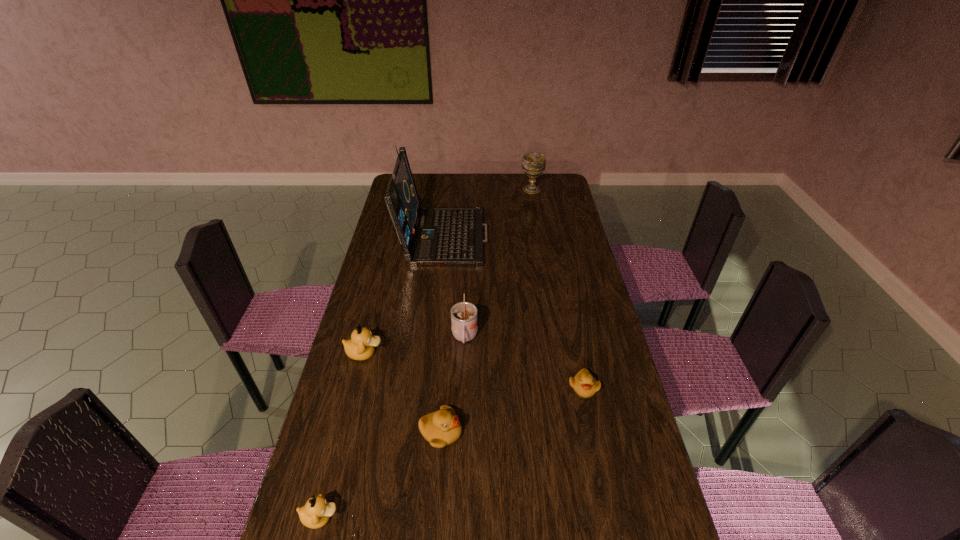
Find the location of a particular element. Image resolution: width=960 pixels, height=540 pixels. the nearer tan duckling is located at coordinates (316, 513).

I want to click on the third nearest object, so click(x=584, y=384).

Identify the location of the farther yellow duckling. The image size is (960, 540). (584, 384).

Find the location of a particular element. vacant space located on the front-facing side of the tallest object is located at coordinates (543, 234).

I want to click on free space located on the front of the second tallest object, so click(537, 220).

Locate an element on the screen. The height and width of the screenshot is (540, 960). vacant point located on the side with the handle of the cup is located at coordinates (463, 385).

This screenshot has width=960, height=540. In order to click on free space located 0.360m on the face of the tallest duckling in this screenshot , I will do `click(497, 353)`.

Find the location of a particular element. The image size is (960, 540). vacant space located 0.350m on the front-facing side of the third farthest duckling is located at coordinates (591, 433).

This screenshot has width=960, height=540. I want to click on free space located on the face of the nearest object, so click(x=404, y=517).

You are a GUI agent. You are given a task and a screenshot of the screen. Output one action in this format:
    pyautogui.click(x=<x>, y=<y>)
    Task: Click on the vacant region located 0.250m on the front-facing side of the shortest duckling
    The width and height of the screenshot is (960, 540).
    Given the screenshot: What is the action you would take?
    pyautogui.click(x=605, y=488)